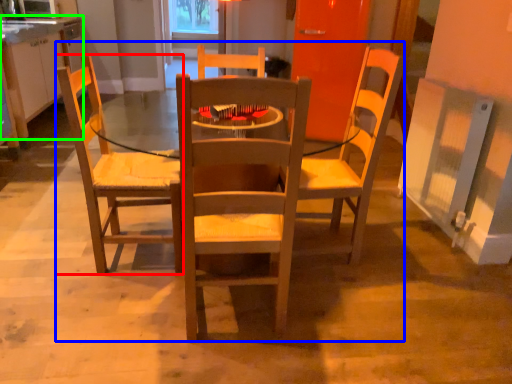
Question: Which object is positioned closest to chair (highlighted by a red box)? Select from trio (highlighted by a blue box) and cabinetry (highlighted by a green box).

Choices:
 (A) trio
 (B) cabinetry

Answer: (A)